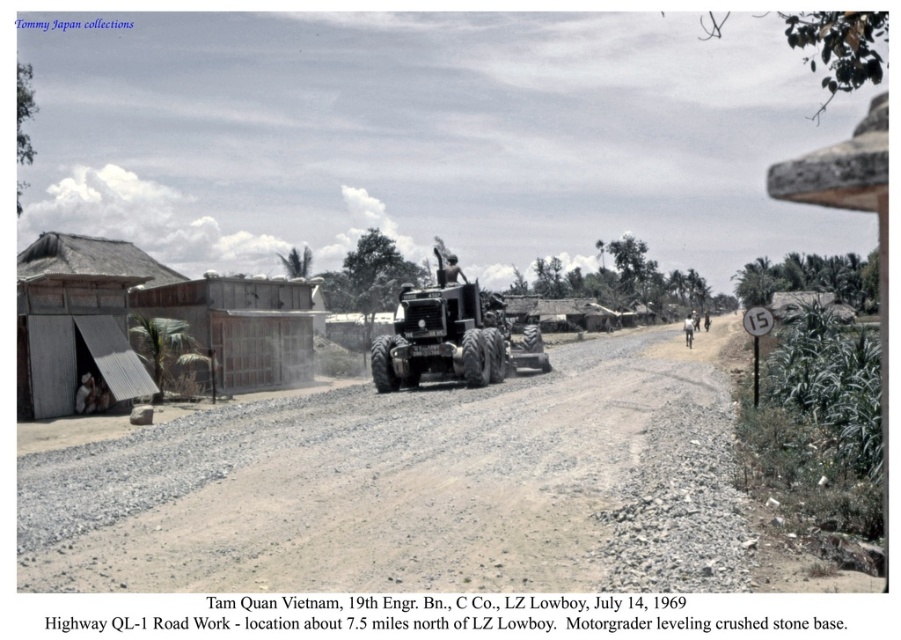
You are a soldier in the 19th Engineer Battalion. You need to move equipment from the metal corrugated hut at left to the gravelly dirt track at center. Which direction should you move the equipment to reach the track?

The gravelly dirt track at center is closer to the viewer than the metal corrugated hut at left, so you should move the equipment forward towards the track.

You are a soldier in the 19th Engineer Battalion, C Company, working on the gravel road construction near LZ Lowboy. You need to move the motorgrader to the metal corrugated hut at left for maintenance. Given the motorgrader is currently at position point A, which is at coordinates point A at position point A at position point A at position point A at position point A at position point A at position point A at position point A at position point A at position point A at position point A at position point A.

The metal corrugated hut at left is located at point point point point point point point point point point point point point point point point point point point point point point point point point point point point point point point point point point point point point point point point point point point point point point point point point point point point point point point point point point point point point point point point point point point point point point point point point point point point point.